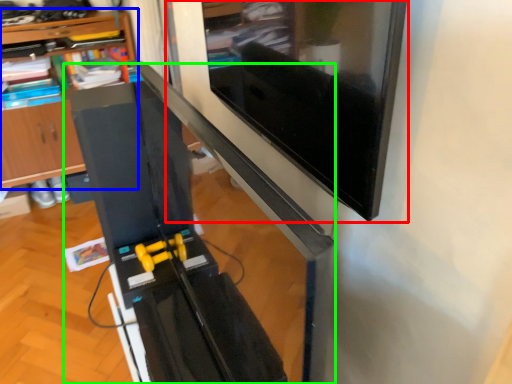
Question: Estimate the real-world distances between objects in this image. Which object is closer to computer monitor (highlighted by a red box), shelf (highlighted by a blue box) or computer desk (highlighted by a green box)?

Choices:
 (A) shelf
 (B) computer desk

Answer: (B)